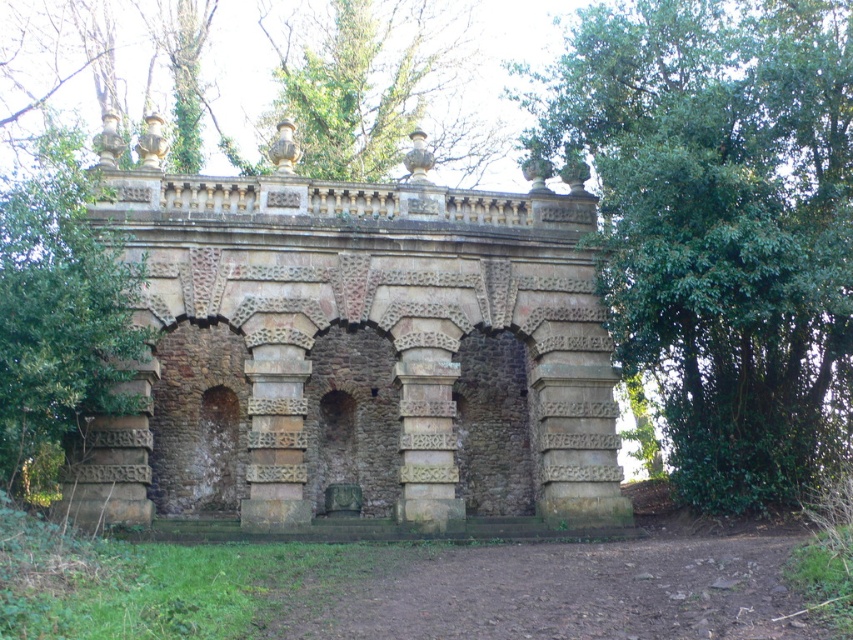
Question: Does brown stone arches at center have a larger size compared to green leafy tree at center?

Choices:
 (A) no
 (B) yes

Answer: (B)

Question: Which point appears farthest from the camera in this image?

Choices:
 (A) (747, 332)
 (B) (26, 301)

Answer: (A)

Question: Is green leafy tree at center to the left of green leafy tree at upper center from the viewer's perspective?

Choices:
 (A) no
 (B) yes

Answer: (B)

Question: Which point is farther to the camera?

Choices:
 (A) (602, 522)
 (B) (370, 97)
 (C) (26, 227)
 (D) (630, 339)

Answer: (B)

Question: Which of the following is the farthest from the observer?

Choices:
 (A) (430, 76)
 (B) (149, 180)
 (C) (671, 243)

Answer: (A)

Question: Is brown stone arches at center to the right of green leafy tree at upper center from the viewer's perspective?

Choices:
 (A) yes
 (B) no

Answer: (A)